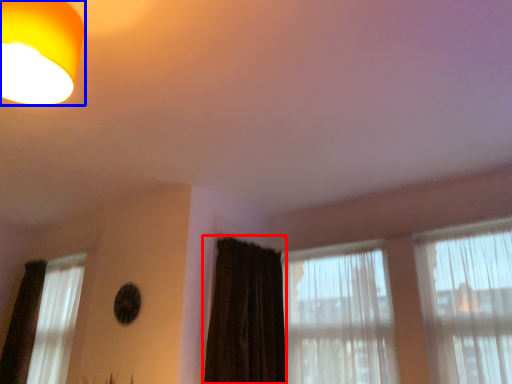
Question: Which object appears farthest to the camera in this image, curtain (highlighted by a red box) or lamp (highlighted by a blue box)?

Choices:
 (A) curtain
 (B) lamp

Answer: (A)